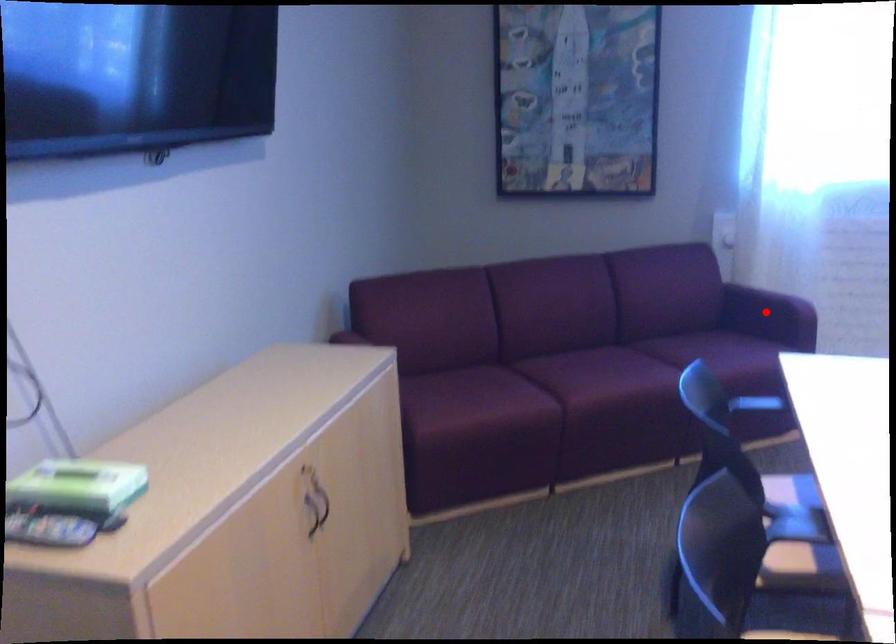
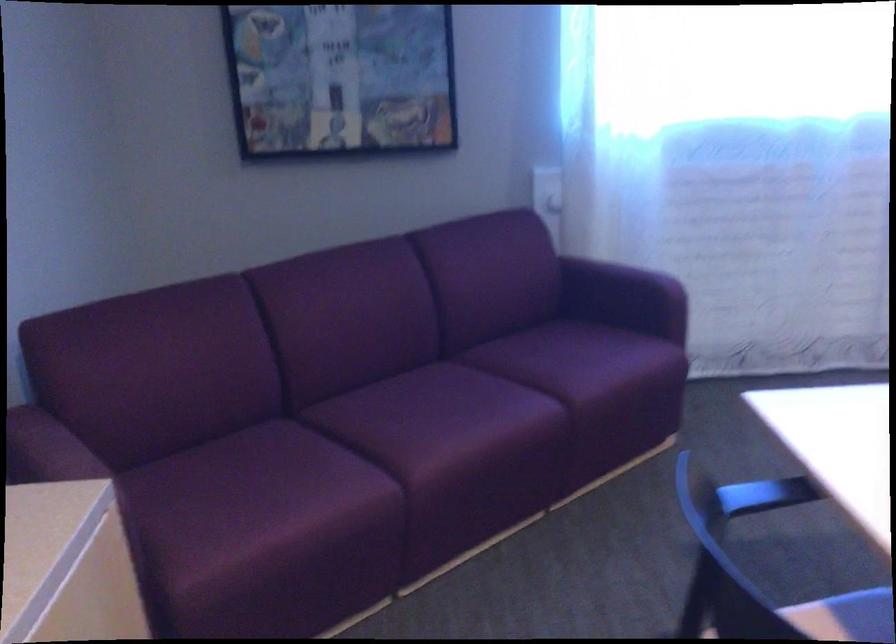
Question: I am providing you with two images of the same scene from different viewpoints. A red point is shown in image1. For the corresponding object point in image2, is it positioned nearer or farther from the camera?

Choices:
 (A) Nearer
 (B) Farther

Answer: (A)